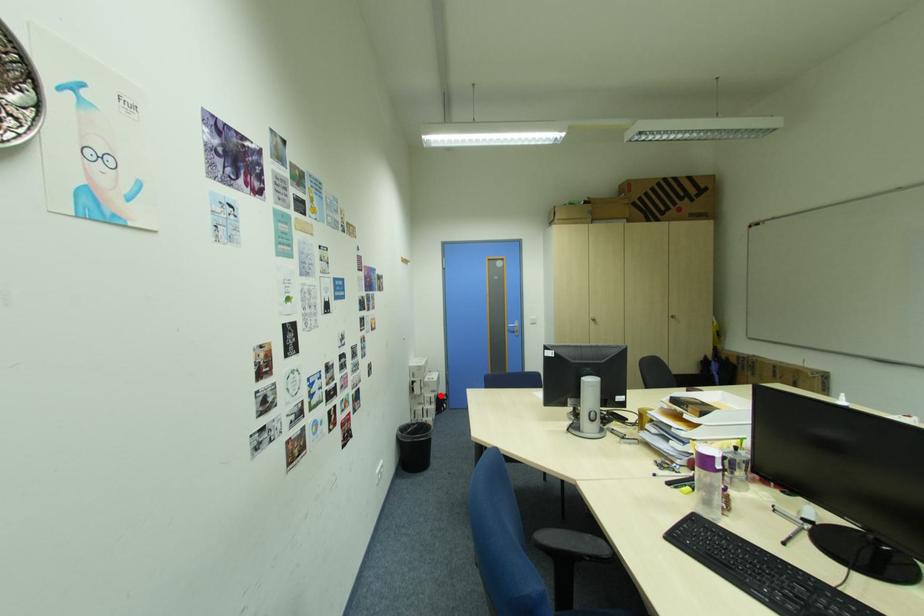
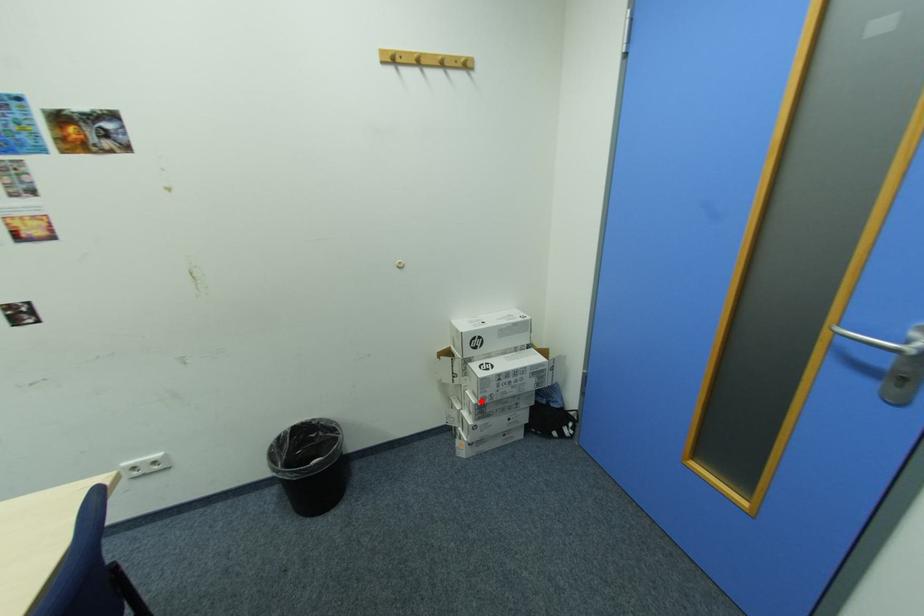
I am providing you with two images of the same scene from different viewpoints. A red point is marked on the first image and another point is marked on the second image. Is the marked point in image1 the same physical position as the marked point in image2?

Yes